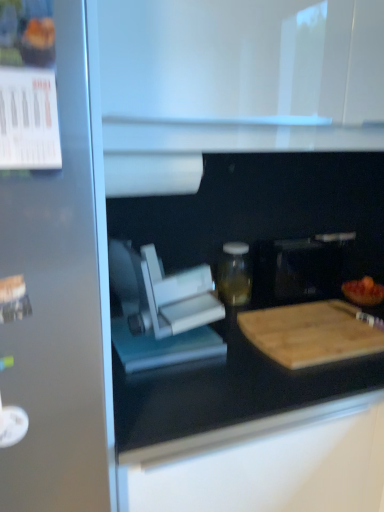
This screenshot has width=384, height=512. In order to click on transparent glass jar at center in this screenshot , I will do `click(234, 274)`.

Locate an element on the screen. The height and width of the screenshot is (512, 384). white matte paper towel at upper center is located at coordinates (152, 174).

Describe the element at coordinates (301, 266) in the screenshot. I see `black matte microwave at center, the 2th appliance from the left` at that location.

Identify the location of wooden cutting board at lower right. [x=310, y=333].

The height and width of the screenshot is (512, 384). In order to click on transparent glass jar at center in this screenshot , I will do `click(234, 274)`.

Does point (266, 250) come closer to viewer compared to point (161, 295)?

No, (266, 250) is further to viewer.

Consider the image. Is black matte microwave at center, which is counted as the 1th appliance, starting from the right, spatially inside white plastic food processor at center, the 2th appliance when ordered from right to left, or outside of it?

black matte microwave at center, which is counted as the 1th appliance, starting from the right, is not enclosed by white plastic food processor at center, the 2th appliance when ordered from right to left.

From a real-world perspective, is black matte microwave at center, the 2th appliance from the front, over white plastic food processor at center, the first appliance when ordered from front to back?

No, from a real-world perspective, black matte microwave at center, the 2th appliance from the front, is not on top of white plastic food processor at center, the first appliance when ordered from front to back.

Which is nearer, (x=117, y=159) or (x=247, y=261)?

Point (x=117, y=159) is closer to the camera than point (x=247, y=261).

Considering the sizes of objects white matte paper towel at upper center and transparent glass jar at center in the image provided, who is thinner, white matte paper towel at upper center or transparent glass jar at center?

transparent glass jar at center.

At what (x,y) coordinates should I click in order to perform the action: click on bottle behind the white matte paper towel at upper center. Please return your answer as a coordinate pair (x, y). Looking at the image, I should click on (234, 274).

Is white matte paper towel at upper center in front of or behind transparent glass jar at center in the image?

In the image, white matte paper towel at upper center appears in front of transparent glass jar at center.

From a real-world perspective, who is located higher, black matte microwave at center, which is counted as the first appliance, starting from the back, or wooden cutting board at right?

In real-world perspective, black matte microwave at center, which is counted as the first appliance, starting from the back, is above.

Is black matte microwave at center, which is counted as the first appliance, starting from the back, located outside wooden cutting board at right?

black matte microwave at center, which is counted as the first appliance, starting from the back, lies outside wooden cutting board at right's area.

Which object is positioned more to the right, black matte microwave at center, which is counted as the first appliance, starting from the back, or wooden cutting board at right?

Positioned to the right is wooden cutting board at right.

Considering the relative sizes of black matte microwave at center, which is counted as the first appliance, starting from the back, and wooden cutting board at right in the image provided, is black matte microwave at center, which is counted as the first appliance, starting from the back, thinner than wooden cutting board at right?

No.

Considering the relative positions of white plastic food processor at center, the 1th appliance viewed from the left, and black matte microwave at center, the 2th appliance from the left, in the image provided, is white plastic food processor at center, the 1th appliance viewed from the left, in front of black matte microwave at center, the 2th appliance from the left,?

Yes.

Who is bigger, white plastic food processor at center, which appears as the second appliance when viewed from the back, or black matte microwave at center, which is counted as the 1th appliance, starting from the right?

white plastic food processor at center, which appears as the second appliance when viewed from the back.

Considering the sizes of objects white plastic food processor at center, the first appliance when ordered from front to back, and black matte microwave at center, which is counted as the 1th appliance, starting from the right, in the image provided, who is taller, white plastic food processor at center, the first appliance when ordered from front to back, or black matte microwave at center, which is counted as the 1th appliance, starting from the right,?

white plastic food processor at center, the first appliance when ordered from front to back, is taller.

Is white plastic food processor at center, the first appliance when ordered from front to back, touching black matte microwave at center, the 2th appliance from the front?

No, white plastic food processor at center, the first appliance when ordered from front to back, is not next to black matte microwave at center, the 2th appliance from the front.

Is transparent glass jar at center facing towards wooden cutting board at right?

No, transparent glass jar at center is not turned towards wooden cutting board at right.

From a real-world perspective, is transparent glass jar at center physically located above or below wooden cutting board at right?

In terms of real-world spatial position, transparent glass jar at center is above wooden cutting board at right.

Considering the sizes of objects transparent glass jar at center and wooden cutting board at right in the image provided, who is shorter, transparent glass jar at center or wooden cutting board at right?

With less height is wooden cutting board at right.

Find the location of `appliance that is the 2nd object located below the transparent glass jar at center (from the image's perspective)`. appliance that is the 2nd object located below the transparent glass jar at center (from the image's perspective) is located at coordinates (161, 292).

Who is more distant, transparent glass jar at center or white plastic food processor at center, the 2th appliance when ordered from right to left?

transparent glass jar at center.

Considering the positions of points (230, 283) and (223, 308), is point (230, 283) closer to camera compared to point (223, 308)?

That is False.

Could you tell me if transparent glass jar at center is facing white plastic food processor at center, the 1th appliance viewed from the left?

No, transparent glass jar at center does not turn towards white plastic food processor at center, the 1th appliance viewed from the left.

From a real-world perspective, is white plastic food processor at center, which appears as the second appliance when viewed from the back, positioned under wooden cutting board at lower right based on gravity?

No.

Is white plastic food processor at center, the first appliance when ordered from front to back, next to wooden cutting board at lower right and touching it?

No, white plastic food processor at center, the first appliance when ordered from front to back, is not making contact with wooden cutting board at lower right.

Locate an element on the screen. This screenshot has height=512, width=384. appliance in front of the wooden cutting board at lower right is located at coordinates (161, 292).

The image size is (384, 512). Identify the location of appliance lying behind the white plastic food processor at center, the 1th appliance viewed from the left. (301, 266).

I want to click on paper towel above the transparent glass jar at center (from a real-world perspective), so click(152, 174).

Estimate the real-world distances between objects in this image. Which object is closer to wooden cutting board at lower right, black matte microwave at center, the 2th appliance from the left, or white matte paper towel at upper center?

black matte microwave at center, the 2th appliance from the left.

Considering their positions, is wooden cutting board at right positioned further to white plastic food processor at center, which appears as the second appliance when viewed from the back, than white matte paper towel at upper center?

wooden cutting board at right is further to white plastic food processor at center, which appears as the second appliance when viewed from the back.

From the image, which object appears to be nearer to wooden cutting board at right, transparent glass jar at center or wooden cutting board at lower right?

A: wooden cutting board at lower right is closer to wooden cutting board at right.

Based on their spatial positions, is transparent glass jar at center or wooden cutting board at right closer to wooden cutting board at lower right?

The object closer to wooden cutting board at lower right is wooden cutting board at right.

From the image, which object appears to be nearer to white plastic food processor at center, the 2th appliance when ordered from right to left, wooden cutting board at lower right or white matte paper towel at upper center?

Among the two, white matte paper towel at upper center is located nearer to white plastic food processor at center, the 2th appliance when ordered from right to left.

Looking at the image, which one is located further to black matte microwave at center, which is counted as the first appliance, starting from the back, wooden cutting board at lower right or white plastic food processor at center, the 1th appliance viewed from the left?

white plastic food processor at center, the 1th appliance viewed from the left.

Estimate the real-world distances between objects in this image. Which object is further from white matte paper towel at upper center, wooden cutting board at right or wooden cutting board at lower right?

The object further to white matte paper towel at upper center is wooden cutting board at right.

Looking at the image, which one is located further to white plastic food processor at center, which appears as the second appliance when viewed from the back, white matte paper towel at upper center or transparent glass jar at center?

transparent glass jar at center is positioned further to the anchor white plastic food processor at center, which appears as the second appliance when viewed from the back.

Find the location of a particular element. Image resolution: width=384 pixels, height=512 pixels. appliance located between white matte paper towel at upper center and black matte microwave at center, the 2th appliance from the front, in the left-right direction is located at coordinates (161, 292).

At what (x,y) coordinates should I click in order to perform the action: click on cutting board between transparent glass jar at center and wooden cutting board at right in the horizontal direction. Please return your answer as a coordinate pair (x, y). Image resolution: width=384 pixels, height=512 pixels. Looking at the image, I should click on [310, 333].

Find the location of a particular element. cutting board located between white matte paper towel at upper center and transparent glass jar at center in the depth direction is located at coordinates (310, 333).

The height and width of the screenshot is (512, 384). Identify the location of cutting board between white plastic food processor at center, which appears as the second appliance when viewed from the back, and wooden cutting board at right from left to right. (310, 333).